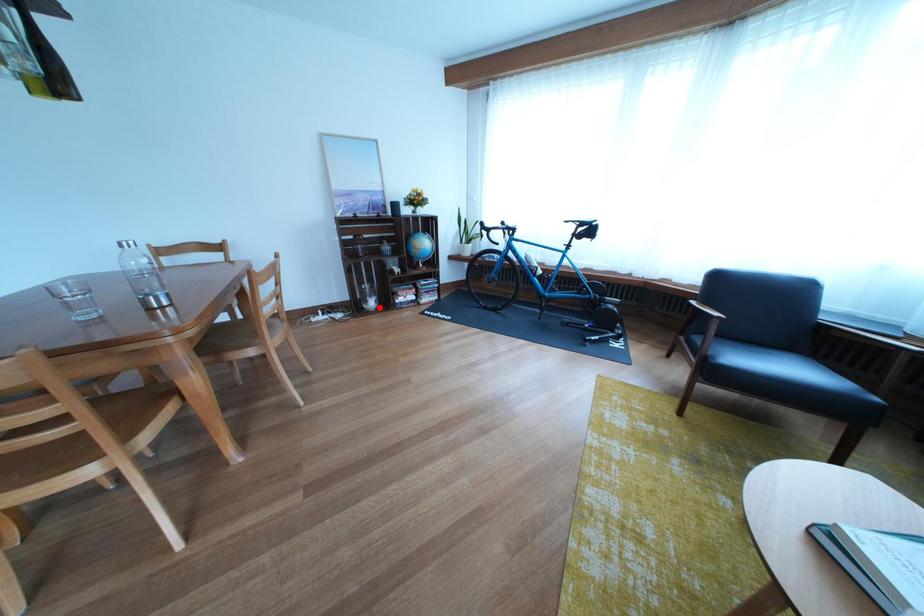
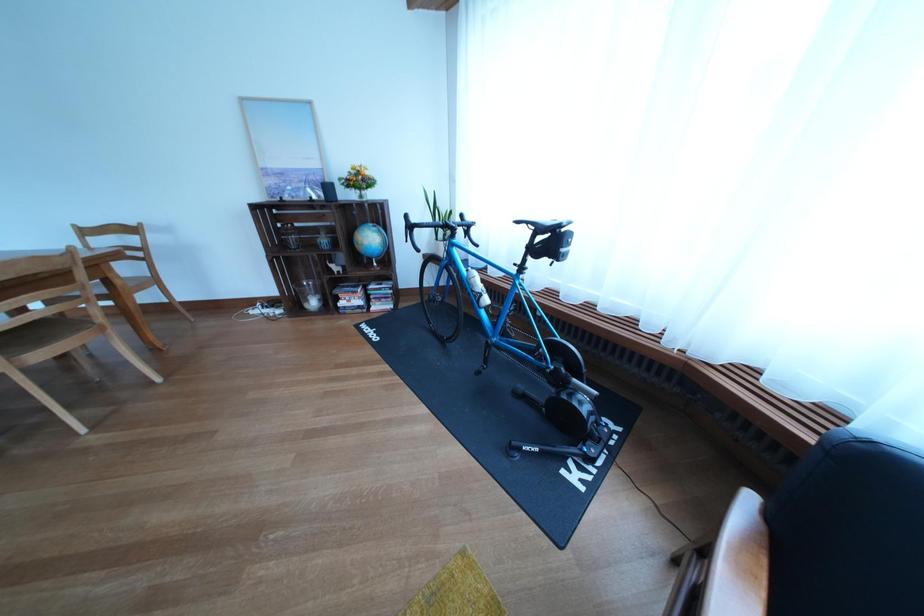
Question: I am providing you with two images of the same scene from different viewpoints. Image1 has a red point marked. In image2, the corresponding 3D location appears at what relative position? Reply with the corresponding letter.

Choices:
 (A) Closer
 (B) Farther

Answer: (B)